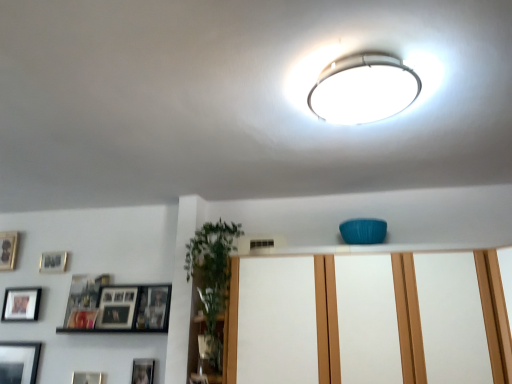
Question: In terms of width, does matte white dresser at center look wider or thinner when compared to wooden photo frame at left, which ranks as the sixth picture frame in right-to-left order?

Choices:
 (A) thin
 (B) wide

Answer: (B)

Question: Considering their positions, is matte white dresser at center located in front of or behind wooden photo frame at left, which ranks as the sixth picture frame in right-to-left order?

Choices:
 (A) behind
 (B) front

Answer: (B)

Question: Estimate the real-world distances between objects in this image. Which object is closer to the matte black picture frame at lower left, which appears as the 2th picture frame when viewed from the right?

Choices:
 (A) matte white dresser at center
 (B) white glossy ceiling light at upper center
 (C) wooden photo frame at left, placed as the 1th picture frame when sorted from left to right
 (D) matte black picture frame at upper left, the third picture frame viewed from the right
 (E) wooden photo frame at lower center, which is counted as the 2th picture frame, starting from the bottom

Answer: (E)

Question: Estimate the real-world distances between objects in this image. Which object is farther from the wooden photo frame at lower center, arranged as the sixth picture frame when viewed from the left?

Choices:
 (A) matte black picture frame at upper left, which ranks as the fourth picture frame in left-to-right order
 (B) wooden photo frame at left, which ranks as the sixth picture frame in right-to-left order
 (C) matte black picture frame at lower left, which appears as the second picture frame when viewed from the left
 (D) matte white dresser at center
 (E) matte silver picture frame at upper left, which ranks as the 2th picture frame in top-to-bottom order

Answer: (B)